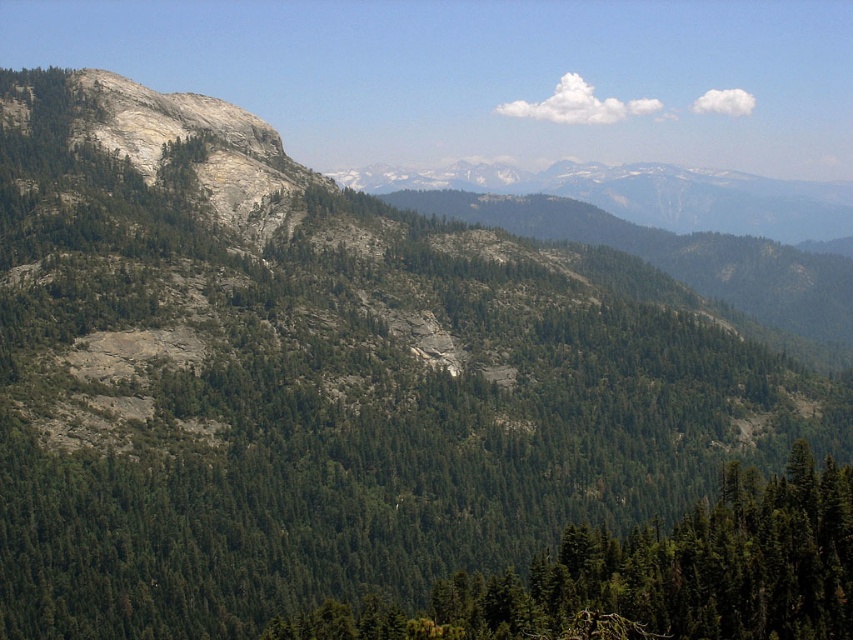
Where is `green matte tree at lower center`? The height and width of the screenshot is (640, 853). green matte tree at lower center is located at coordinates (653, 576).

Does green matte tree at lower center have a larger size compared to gray rocky mountain range at center?

Incorrect, green matte tree at lower center is not larger than gray rocky mountain range at center.

Is point (744, 497) closer to camera compared to point (544, 195)?

Yes, point (744, 497) is closer to viewer.

Locate an element on the screen. The width and height of the screenshot is (853, 640). green matte tree at lower center is located at coordinates (653, 576).